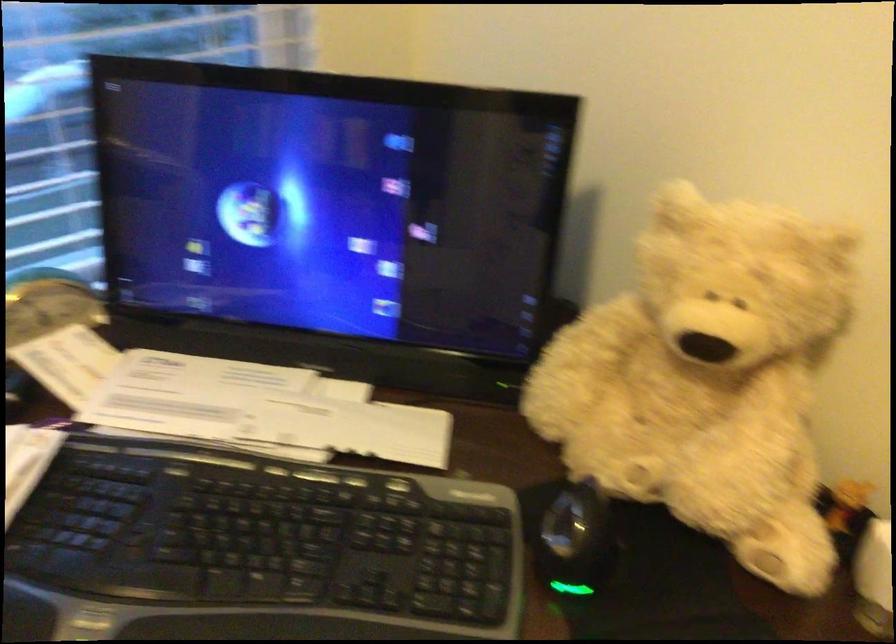
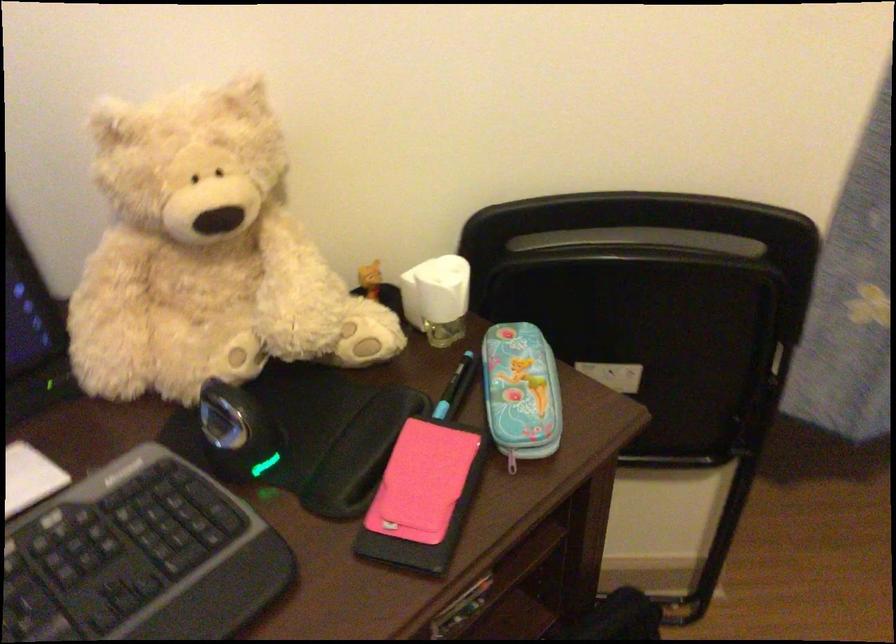
Locate, in the second image, the point that corresponds to pixel 581 506 in the first image.

(230, 402)